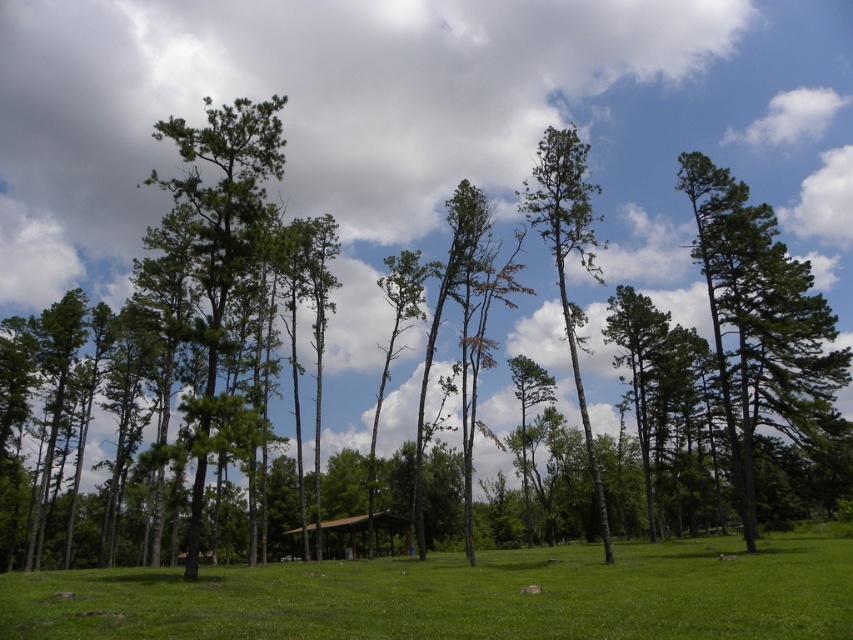
Question: Does green grass at center appear over brown wooden hut at center?

Choices:
 (A) yes
 (B) no

Answer: (A)

Question: Does green matte tree at right have a greater width compared to brown wooden hut at center?

Choices:
 (A) yes
 (B) no

Answer: (A)

Question: Which object is closer to the camera taking this photo?

Choices:
 (A) green matte tree at right
 (B) green grass at center
 (C) brown wooden hut at center

Answer: (B)

Question: Among these points, which one is farthest from the camera?

Choices:
 (A) (289, 532)
 (B) (409, 563)

Answer: (A)

Question: Is green matte tree at right thinner than brown wooden hut at center?

Choices:
 (A) no
 (B) yes

Answer: (A)

Question: Which point is farther to the camera?

Choices:
 (A) (376, 518)
 (B) (728, 241)

Answer: (A)